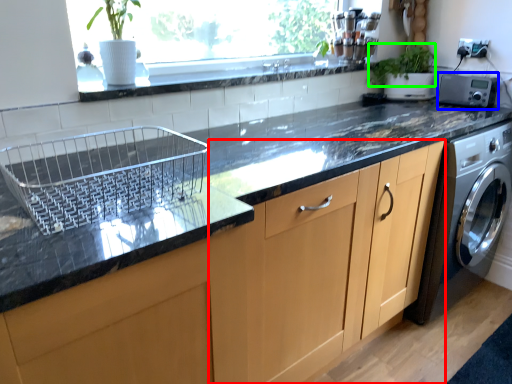
Question: Which is farther away from cabinetry (highlighted by a red box)? appliance (highlighted by a blue box) or plant (highlighted by a green box)?

Choices:
 (A) appliance
 (B) plant

Answer: (B)